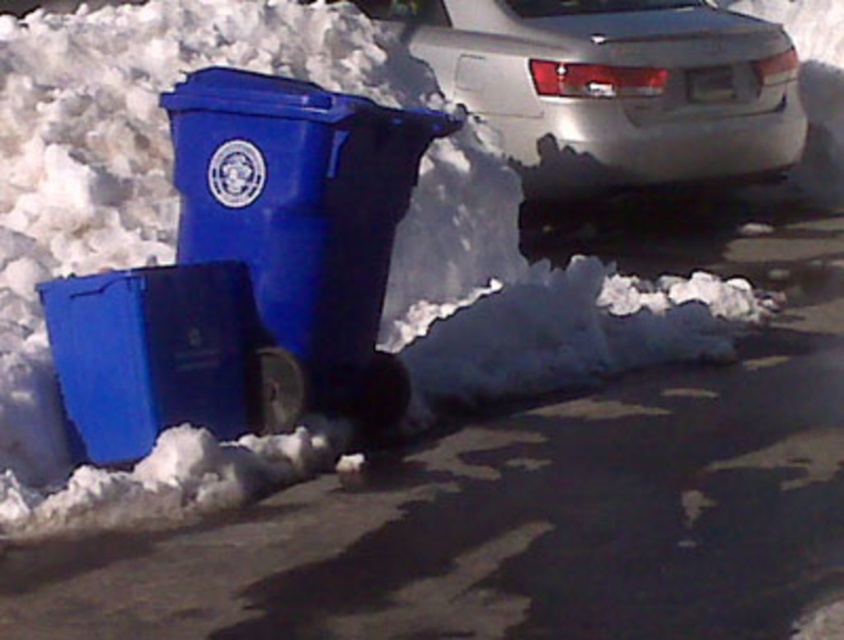
You are standing at the point marked as point (613, 86) in the image. What object is directly in front of you?

The silver metallic sedan at upper right is directly in front of you at point (613, 86).

You are a delivery person trying to place a package between the smooth asphalt at lower center and the matte plastic recycling bin at left. Can you fit the package there?

The smooth asphalt at lower center is to the right of the matte plastic recycling bin at left, so there is space between them where the package can be placed.

You are a delivery person trying to park your van in this snowy area. Your van is 10 feet long. There is a smooth asphalt at lower center and a silver metallic sedan at upper right. Can your van fit between them without touching either?

The distance between the smooth asphalt at lower center and the silver metallic sedan at upper right is 6.51 feet. Since your van is 10 feet long, it cannot fit in the space between them.